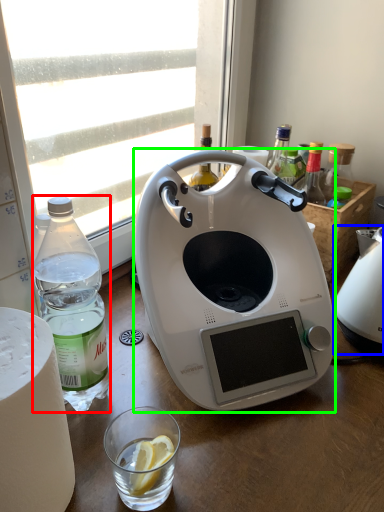
Question: Which object is the closest to the bottle (highlighted by a red box)? Choose among these: kitchen appliance (highlighted by a blue box) or kitchen appliance (highlighted by a green box).

Choices:
 (A) kitchen appliance
 (B) kitchen appliance

Answer: (B)